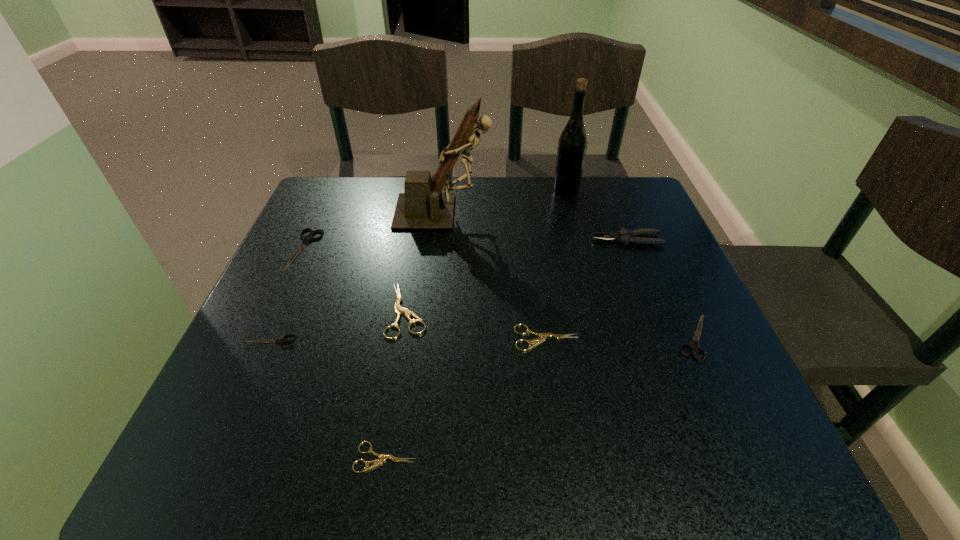
In the image, there is a desktop. Identify the location of vacant space at the far edge. Image resolution: width=960 pixels, height=540 pixels. (495, 182).

This screenshot has height=540, width=960. What are the coordinates of `vacant space at the near edge of the desktop` in the screenshot? It's located at 511,450.

I want to click on free space at the left edge, so click(332, 296).

Identify the location of blank area at the right edge. (716, 330).

The width and height of the screenshot is (960, 540). What are the coordinates of `free spot at the far left corner of the desktop` in the screenshot? It's located at (331, 179).

Locate an element on the screen. vacant region at the far right corner of the desktop is located at coordinates click(607, 195).

Image resolution: width=960 pixels, height=540 pixels. Find the location of `vacant area between the shortest shears and the fourth tallest object`. vacant area between the shortest shears and the fourth tallest object is located at coordinates (346, 354).

Find the location of a particular element. free area in between the pliers and the beer bottle is located at coordinates (596, 215).

What are the coordinates of `free area in between the brown figurine and the biggest beige shears` in the screenshot? It's located at (425, 261).

Locate an element on the screen. This screenshot has width=960, height=540. free space that is in between the fifth shears from left to right and the rightmost shears is located at coordinates (620, 338).